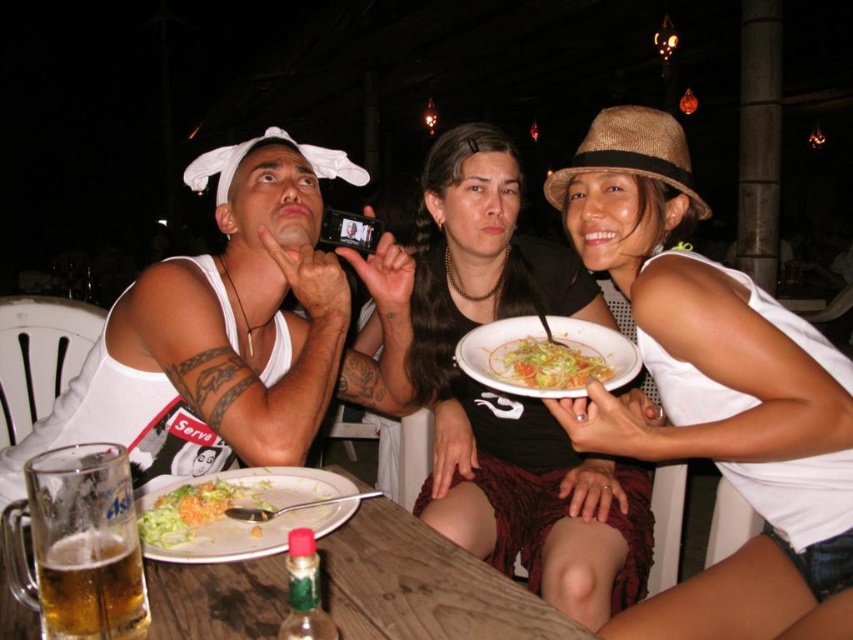
Which of these two, white matte tank top at upper right or foamy golden beer at table left, stands shorter?

foamy golden beer at table left is shorter.

Does white matte tank top at upper right have a lesser height compared to foamy golden beer at table left?

In fact, white matte tank top at upper right may be taller than foamy golden beer at table left.

Which is in front, point (676, 129) or point (120, 600)?

Positioned in front is point (120, 600).

Find the location of a particular element. This screenshot has height=640, width=853. white matte tank top at upper right is located at coordinates (712, 394).

Does white tank top at left have a lesser width compared to white ceramic plate at center?

Incorrect, white tank top at left's width is not less than white ceramic plate at center's.

Where is `white tank top at left`? This screenshot has height=640, width=853. white tank top at left is located at coordinates (236, 332).

Locate an element on the screen. This screenshot has height=640, width=853. white tank top at left is located at coordinates (236, 332).

The height and width of the screenshot is (640, 853). What do you see at coordinates (236, 332) in the screenshot? I see `white tank top at left` at bounding box center [236, 332].

Who is positioned more to the right, white tank top at left or translucent glass mug at lower left?

translucent glass mug at lower left

The height and width of the screenshot is (640, 853). Describe the element at coordinates (236, 332) in the screenshot. I see `white tank top at left` at that location.

This screenshot has width=853, height=640. In order to click on white tank top at left in this screenshot , I will do `click(236, 332)`.